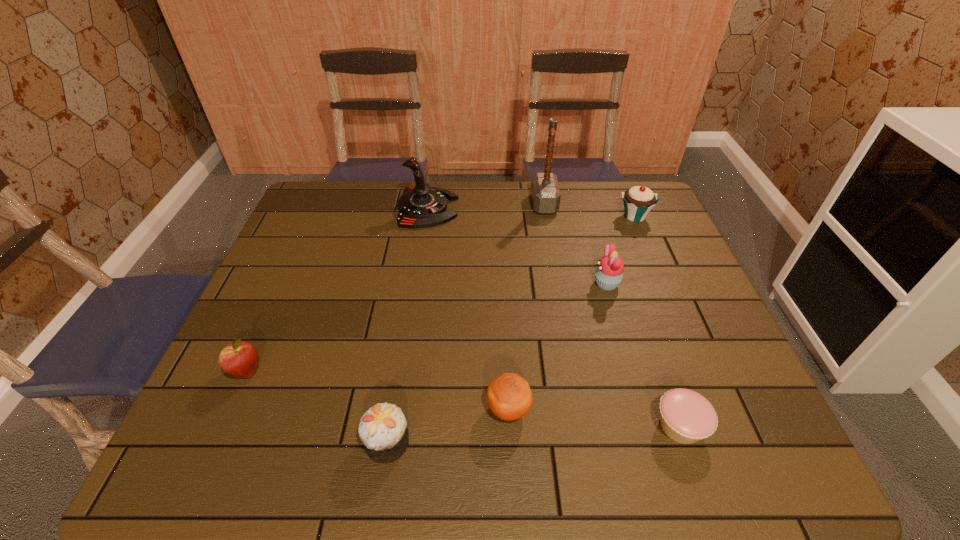
The height and width of the screenshot is (540, 960). I want to click on free point located 0.200m on the striking surface of the tallest object, so click(472, 204).

Locate an element on the screen. Image resolution: width=960 pixels, height=540 pixels. free spot located on the striking surface of the tallest object is located at coordinates (491, 204).

This screenshot has width=960, height=540. In order to click on vacant space located 0.260m on the striking surface of the tallest object in this screenshot , I will do (x=454, y=204).

I want to click on vacant space located 0.350m on the handle side of the second tallest object, so click(x=564, y=208).

The width and height of the screenshot is (960, 540). Identify the location of vacant region located 0.260m on the front of the farthest cupcake. (664, 286).

Locate an element on the screen. This screenshot has width=960, height=540. vacant space located on the face of the third nearest cupcake is located at coordinates (564, 284).

You are a GUI agent. You are given a task and a screenshot of the screen. Output one action in this format:
    pyautogui.click(x=<x>, y=<y>)
    Task: Click on the free region located on the face of the third nearest cupcake
    
    Given the screenshot: What is the action you would take?
    pyautogui.click(x=491, y=284)

This screenshot has width=960, height=540. I want to click on blank space located 0.250m on the face of the third nearest cupcake, so click(502, 284).

Where is `vacant space located on the right of the apple`? This screenshot has width=960, height=540. vacant space located on the right of the apple is located at coordinates (426, 372).

You are a GUI agent. You are given a task and a screenshot of the screen. Output one action in this format:
    pyautogui.click(x=<x>, y=<y>)
    Task: Click on the free space located 0.080m on the back of the fifth object from right to left
    The width and height of the screenshot is (960, 540).
    Given the screenshot: What is the action you would take?
    pyautogui.click(x=506, y=360)